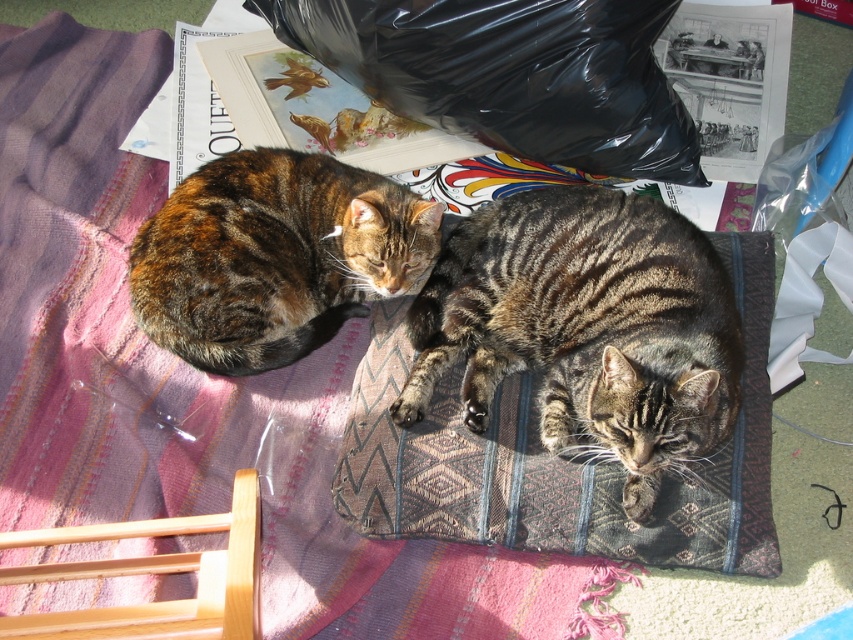
You are a photographer trying to capture a closeup of the tabby fur cat at left without including the black plastic bag at upper center in the frame. Based on their positions, is this possible?

The black plastic bag at upper center is above the tabby fur cat at left, so it is possible to adjust the camera angle downward to exclude the black plastic bag at upper center while focusing on the tabby fur cat at left.

You are a cat owner who wants to place a new toy between the black plastic bag at upper center and the tabby fur cat at left. Based on their positions, where should you place the toy?

The black plastic bag at upper center is positioned on the right side of the tabby fur cat at left, so you should place the toy to the left of the black plastic bag at upper center and to the right of the tabby fur cat at left.

You are a cat owner who wants to place a new toy between the pink woven blanket at upper left and the tabby fur cat at left. Based on their relative sizes, which object should you place the toy closer to?

The pink woven blanket at upper left is much taller than the tabby fur cat at left, so you should place the toy closer to the pink woven blanket at upper left to avoid it being hidden by the blanket.